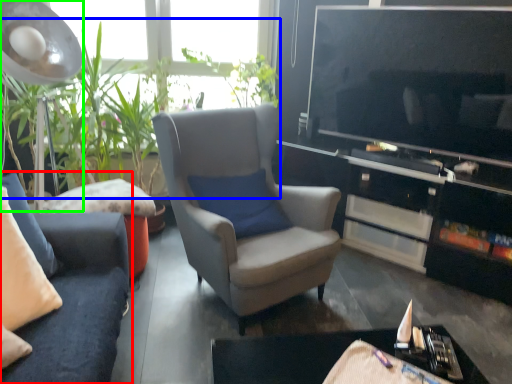
Question: Considering the real-world distances, which object is closest to studio couch (highlighted by a red box)? vegetation (highlighted by a blue box) or lamp (highlighted by a green box).

Choices:
 (A) vegetation
 (B) lamp

Answer: (A)